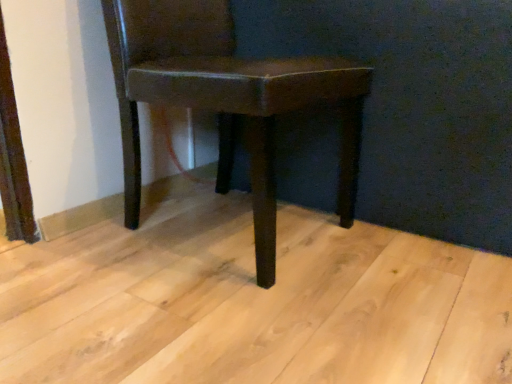
What are the coordinates of `vacant space underneath matte brown leather chair at center (from a real-world perspective)` in the screenshot? It's located at (217, 228).